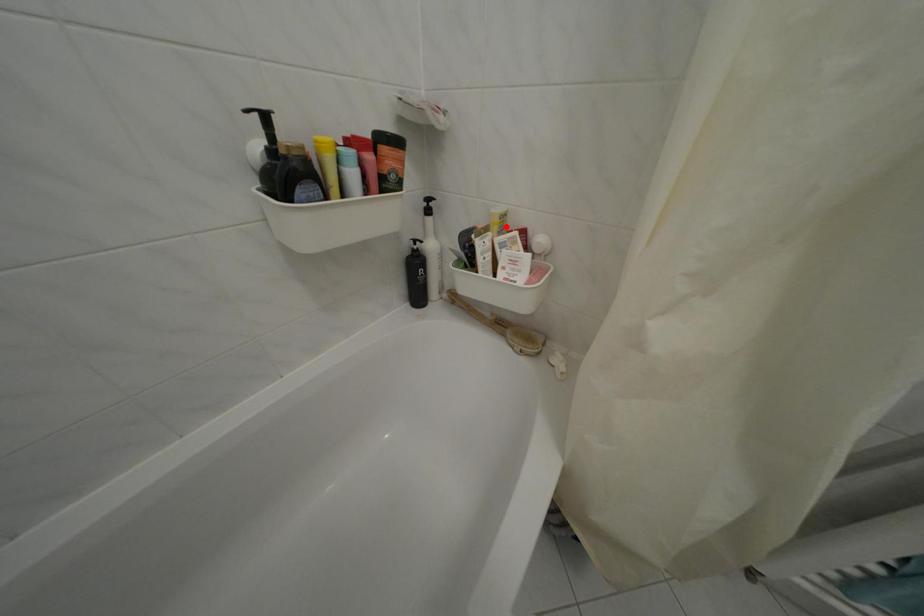
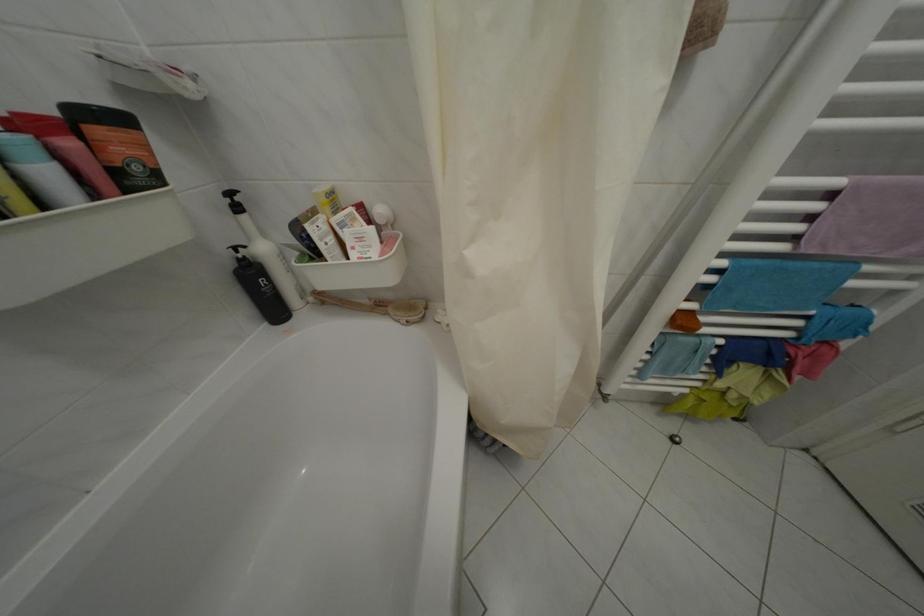
Where in the second image is the point corresponding to the highlighted location from the first image?

(334, 206)